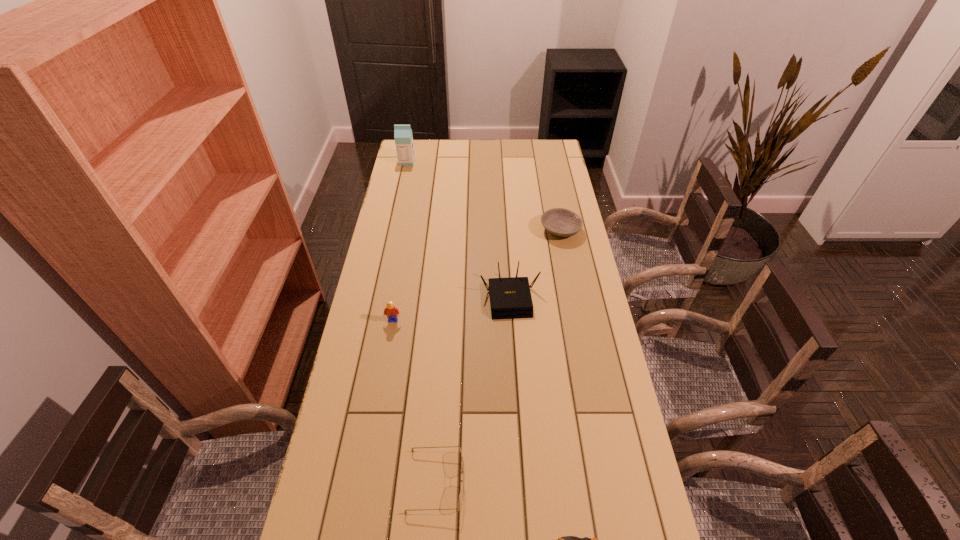
Identify which object is the second closest to the third object from left to right. Please provide its 2D coordinates. Your answer should be formatted as a tuple, i.e. [(x, y)], where the tuple contains the x and y coordinates of a point satisfying the conditions above.

[(390, 311)]

I want to click on object that can be found as the closest to the Lego, so click(x=510, y=298).